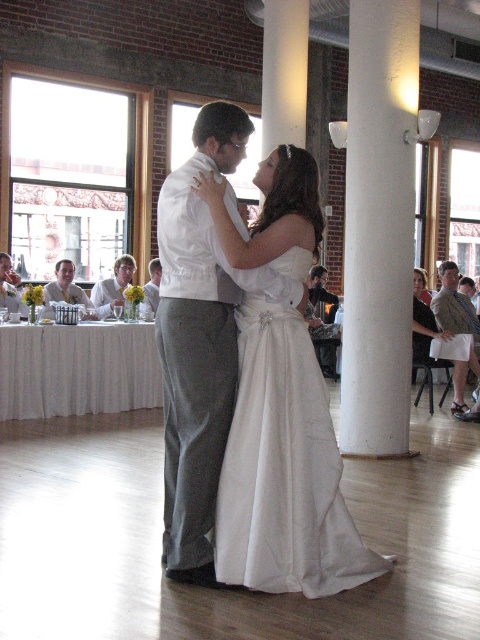
You are a photographer at the wedding reception. You need to capture a photo of the dark brown leather jacket at center and the white satin suit at center. Which one is positioned lower in the image?

The dark brown leather jacket at center is located below the white satin suit at center, so it is positioned lower in the image.

You are a photographer standing at the back of the room. You want to take a photo of the couple dancing. Which of the two, the white satin dress at center or the matte gray suit at center, will appear larger in the photo?

The white satin dress at center will appear larger in the photo because it is closer to the viewer than the matte gray suit at center.

You are a photographer positioned at the entrance of the room. You want to capture a full body shot of the couple dancing at the center. Based on their heights, which one of the two, the white satin dress at center or the matte gray suit at center, should you adjust your camera angle to focus on to ensure both are fully visible?

The white satin dress at center is taller than the matte gray suit at center. To ensure both are fully visible, adjust the camera angle to focus on the taller white satin dress at center, allowing the shorter matte gray suit at center to remain in frame.